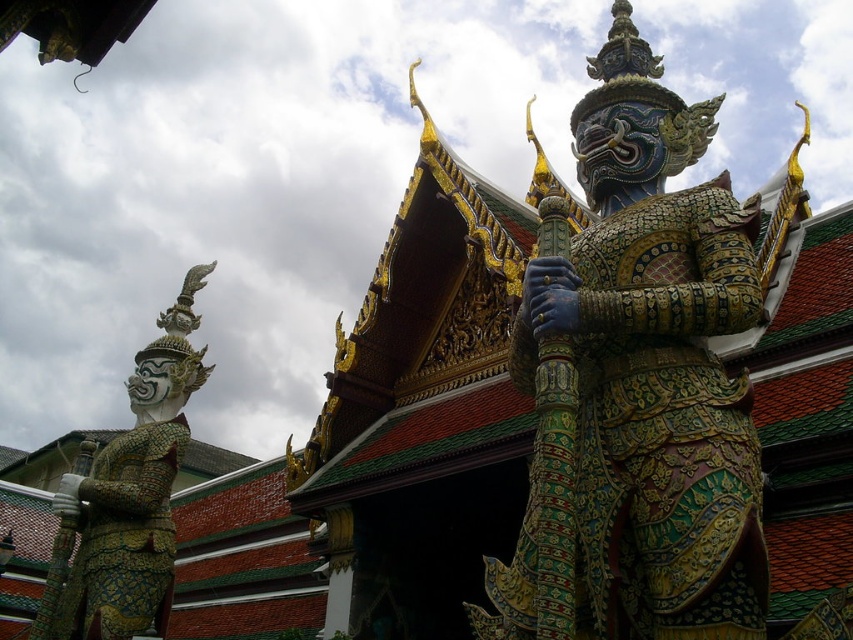
You are standing in front of the traditional Thai building and see the multicolored ornate statue at center and the gold textured armor at left. Which statue is positioned to the right of the other?

The multicolored ornate statue at center is positioned to the right of the gold textured armor at left.

You are standing in front of two statues in front of a traditional Thai building. You notice two points marked on the statues. The first point is at coordinate point (584, 99) and the second is at point (192, 353). Which point is nearer to you?

Point (584, 99) is closer to the viewer than point (192, 353).